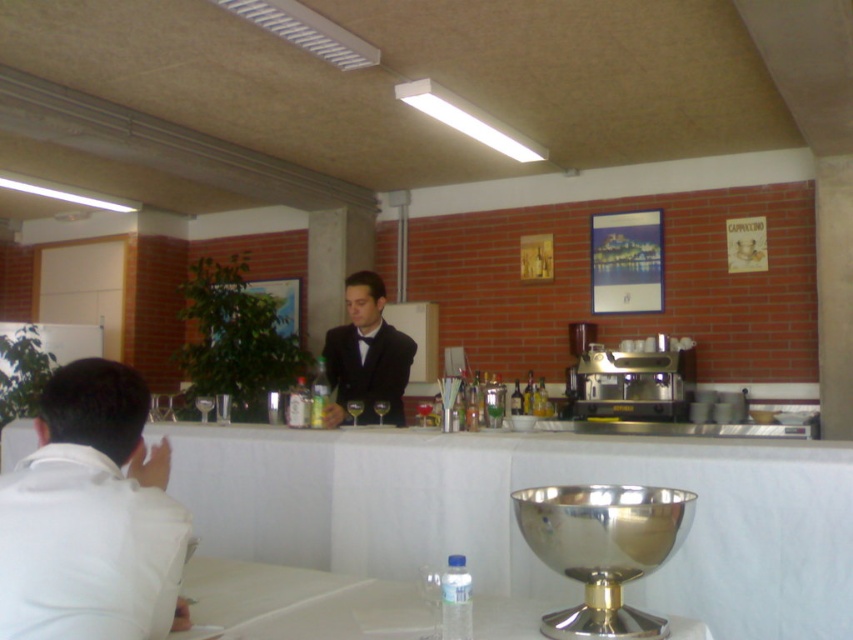
Question: Which point is farther to the camera?

Choices:
 (A) black satin suit at center
 (B) white matte shirt at left
 (C) white fabric table at center

Answer: (A)

Question: Among these objects, which one is nearest to the camera?

Choices:
 (A) white fabric table at center
 (B) black satin suit at center

Answer: (A)

Question: Based on their relative distances, which object is farther from the black satin suit at center?

Choices:
 (A) white matte shirt at left
 (B) white fabric table at center

Answer: (A)

Question: Does white fabric table at center have a greater width compared to white matte shirt at left?

Choices:
 (A) no
 (B) yes

Answer: (B)

Question: Is white matte shirt at left bigger than black satin suit at center?

Choices:
 (A) no
 (B) yes

Answer: (A)

Question: Can you confirm if white fabric table at center is positioned below black satin suit at center?

Choices:
 (A) no
 (B) yes

Answer: (B)